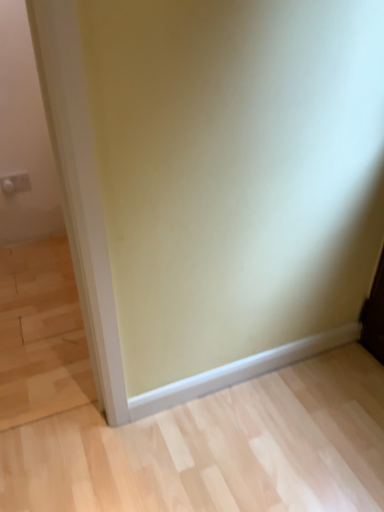
The image size is (384, 512). In order to click on white plastic electric outlet at upper left in this screenshot , I will do `click(15, 183)`.

What do you see at coordinates (15, 183) in the screenshot? I see `white plastic electric outlet at upper left` at bounding box center [15, 183].

You are a GUI agent. You are given a task and a screenshot of the screen. Output one action in this format:
    pyautogui.click(x=<x>, y=<y>)
    Task: Click on the white plastic electric outlet at upper left
    The height and width of the screenshot is (512, 384).
    Given the screenshot: What is the action you would take?
    pyautogui.click(x=15, y=183)